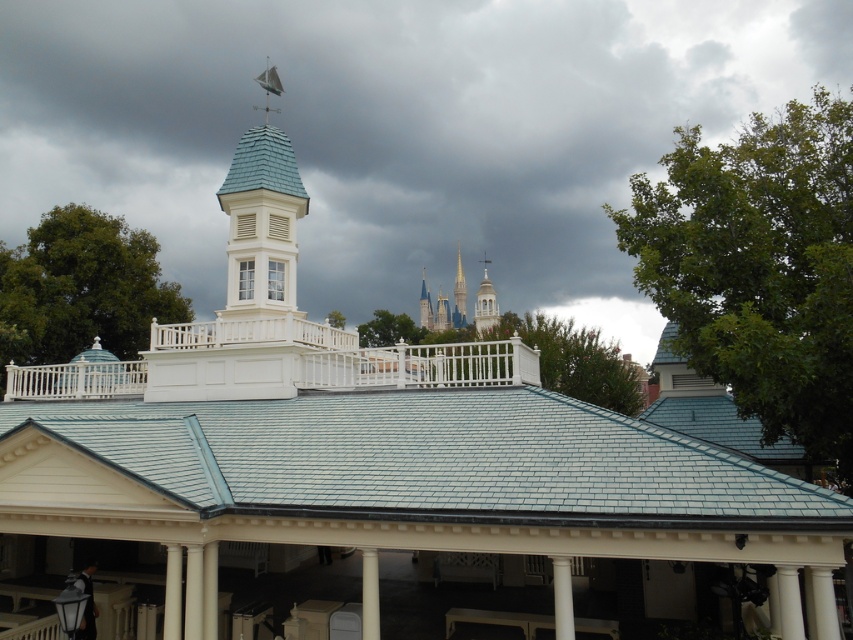
Question: Is white painted wood porch at center thinner than white stucco tower at center?

Choices:
 (A) no
 (B) yes

Answer: (A)

Question: Which point is closer to the camera?

Choices:
 (A) white glossy column at center
 (B) white smooth pillar at center
 (C) gray cloudy sky at upper center

Answer: (A)

Question: Which point is farther to the camera?

Choices:
 (A) white painted wood porch at center
 (B) white stucco tower at center
 (C) shiny silver spire at center
 (D) gray cloudy sky at upper center

Answer: (C)

Question: Which object is closer to the camera taking this photo?

Choices:
 (A) white stucco tower at center
 (B) gray cloudy sky at upper center

Answer: (B)

Question: Can you confirm if teal slate roof at center is smaller than white smooth pillar at center?

Choices:
 (A) yes
 (B) no

Answer: (B)

Question: Is white wood weather vane at upper center further to the viewer compared to white stucco tower at center?

Choices:
 (A) yes
 (B) no

Answer: (B)